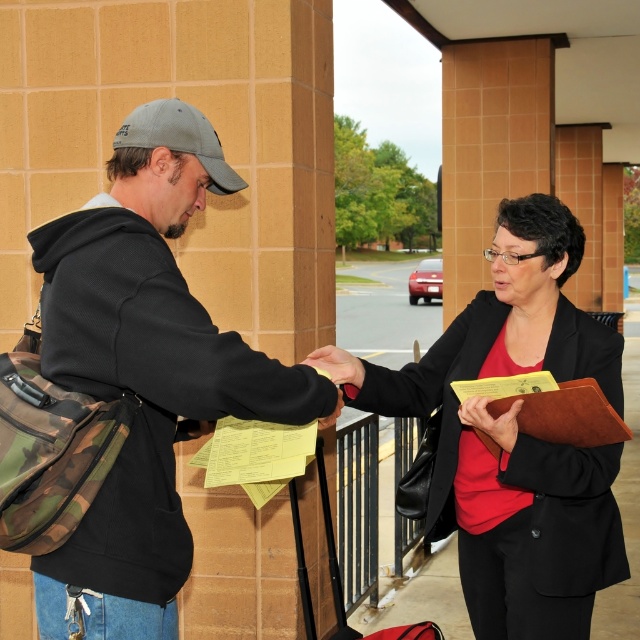
You are a photographer standing in front of the two people. You want to take a photo that clearly shows both the camo fabric bag at left and the matte black blazer at center. Which object should you focus on to ensure both are in sharp focus?

You should focus on the matte black blazer at center because it is farther away from the viewer than the camo fabric bag at left. By focusing on the farther object, the near object will also be in focus due to the depth of field.

You are a photographer trying to capture a clear photo of the matte black blazer at center without the camo fabric bag at left blocking it. Can you adjust your camera angle to achieve this?

The camo fabric bag at left is positioned over the matte black blazer at center, so adjusting the camera angle downward might allow you to capture the matte black blazer at center without obstruction.

You are a photographer standing 10 feet away from the two people. You want to take a photo that includes both the camo fabric bag at left and the matte black blazer at center without any part of them being cut off. What is the minimum width of your camera lens in inches to capture both objects in frame?

The camo fabric bag at left is 29.51 inches from the matte black blazer at center. To capture both objects without any part being cut off, the minimum width of the camera lens should be at least 29.51 inches.